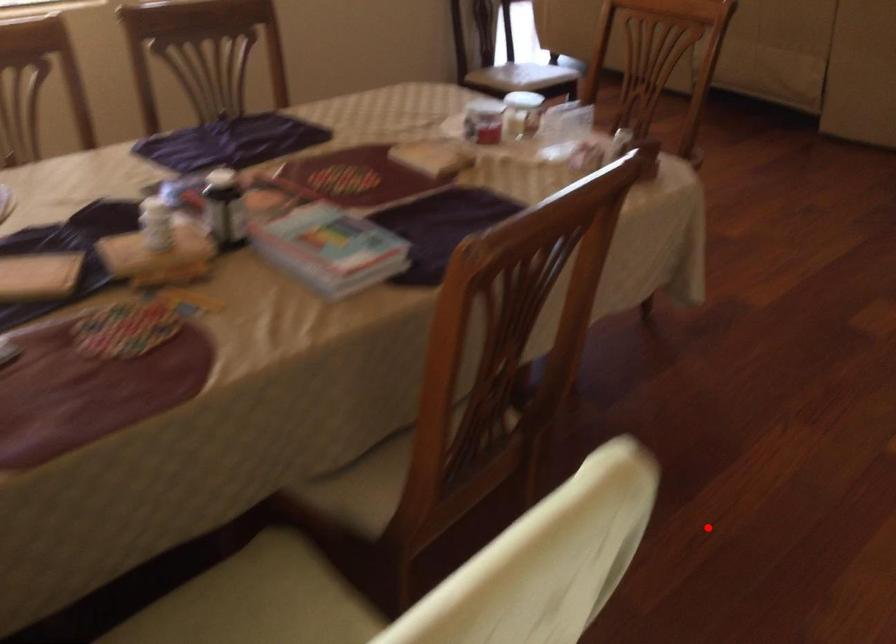
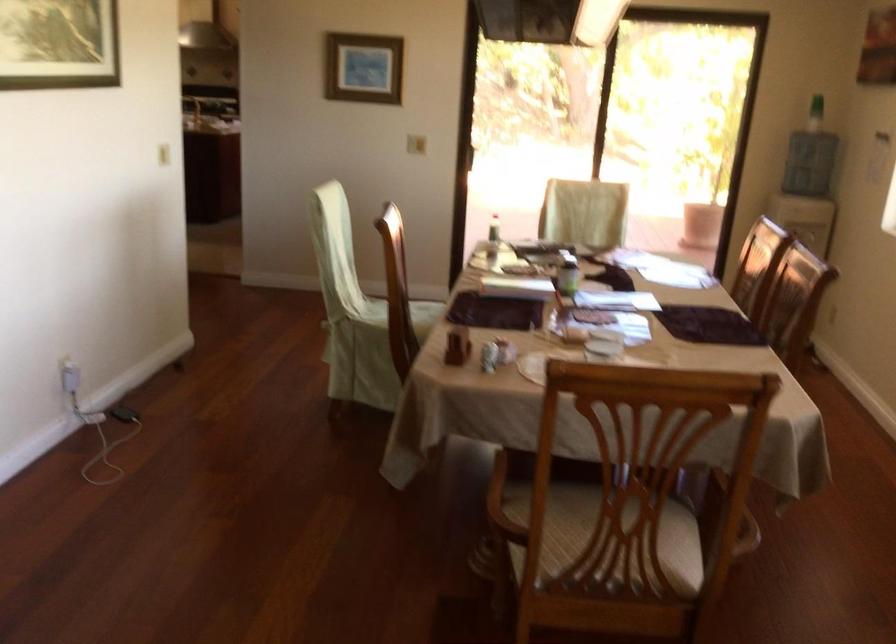
Question: I am providing you with two images of the same scene from different viewpoints. A red point is shown in image1. For the corresponding object point in image2, is it positioned nearer or farther from the camera?

Choices:
 (A) Nearer
 (B) Farther

Answer: (B)